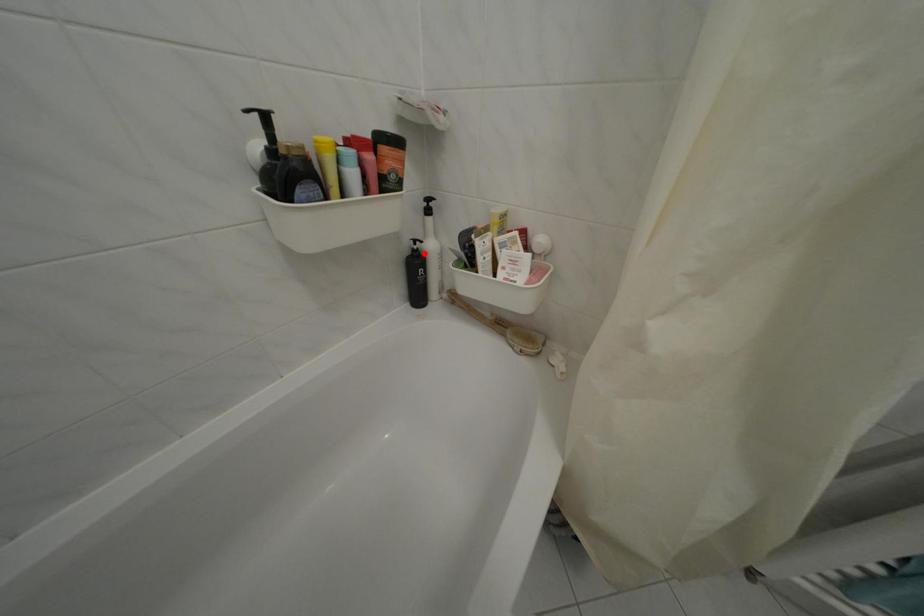
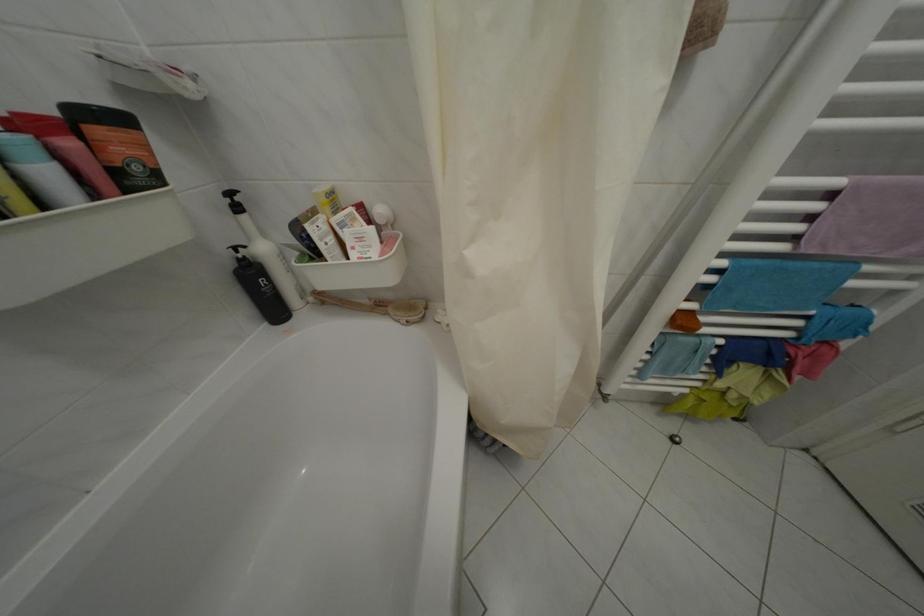
In the second image, find the point that corresponds to the highlighted location in the first image.

(249, 262)